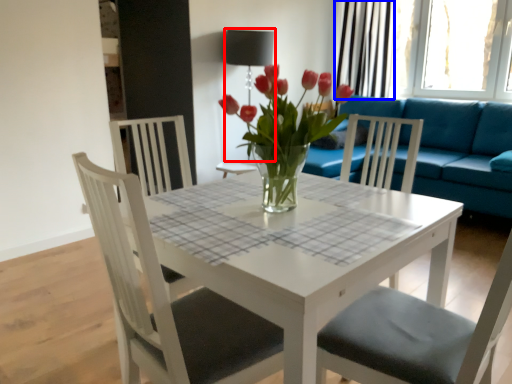
Question: Which of the following is the closest to the observer, lamp (highlighted by a red box) or curtain (highlighted by a blue box)?

Choices:
 (A) lamp
 (B) curtain

Answer: (A)